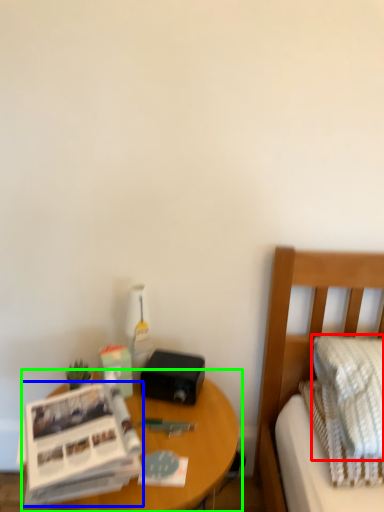
Question: Which is farther away from pillow (highlighted by a red box)? paperback book (highlighted by a blue box) or nightstand (highlighted by a green box)?

Choices:
 (A) paperback book
 (B) nightstand

Answer: (A)